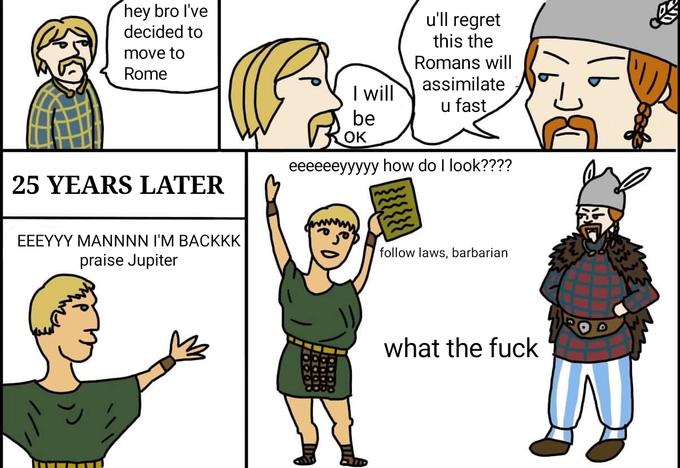
Identify the location of the left sock. (345, 457).